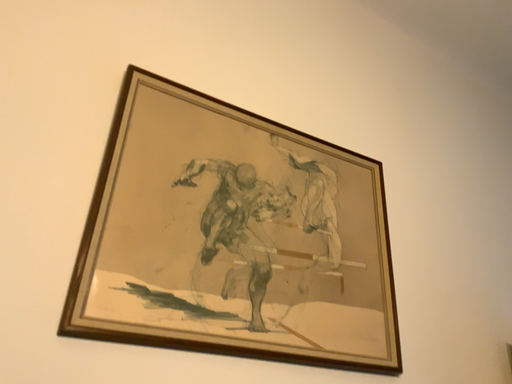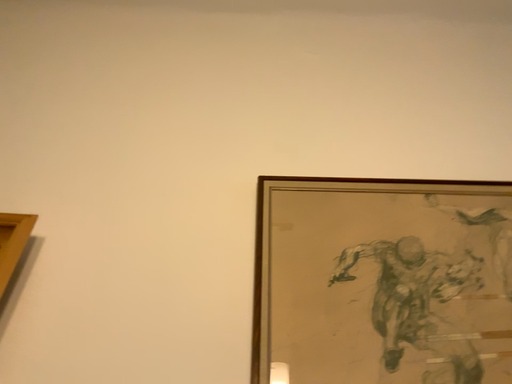
Question: Which way did the camera rotate in the video?

Choices:
 (A) rotated left
 (B) rotated right

Answer: (A)